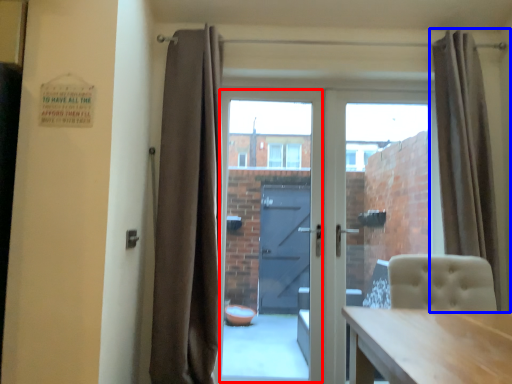
Question: Which of the following is the closest to the observer, glass door (highlighted by a red box) or curtain (highlighted by a blue box)?

Choices:
 (A) glass door
 (B) curtain

Answer: (B)